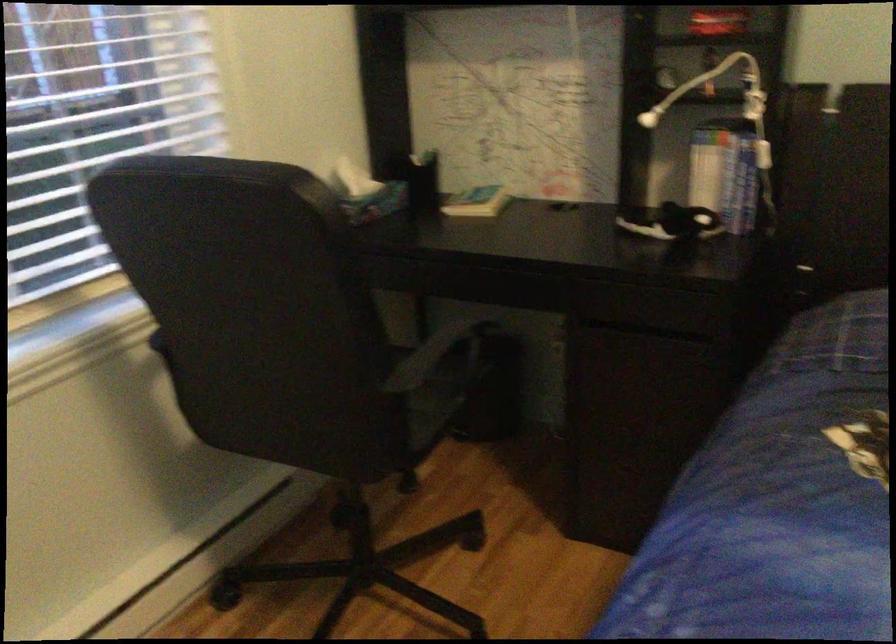
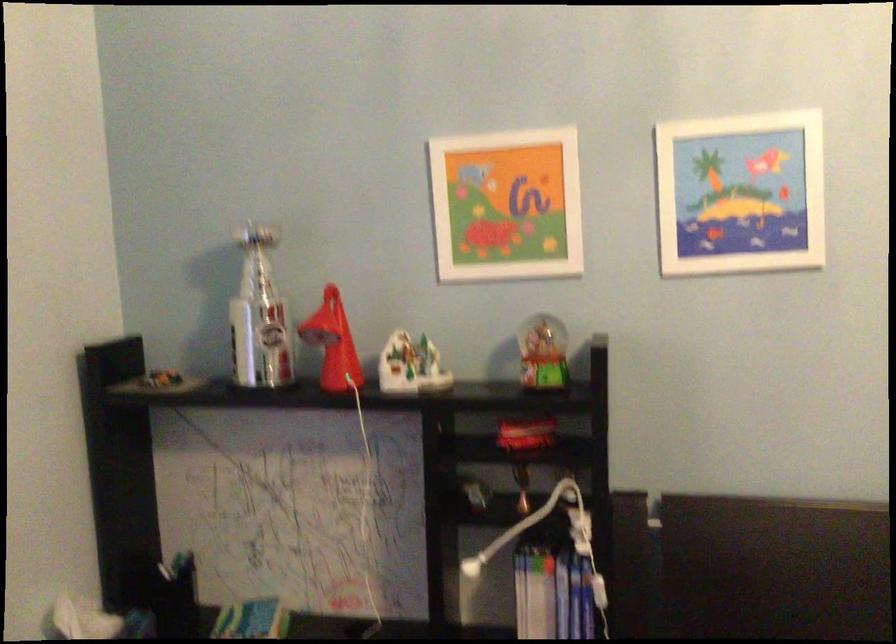
Question: Which direction would the cameraman need to move to produce the second image? Reply with the corresponding letter.

Choices:
 (A) Left
 (B) Right
 (C) Forward
 (D) Backward

Answer: (C)